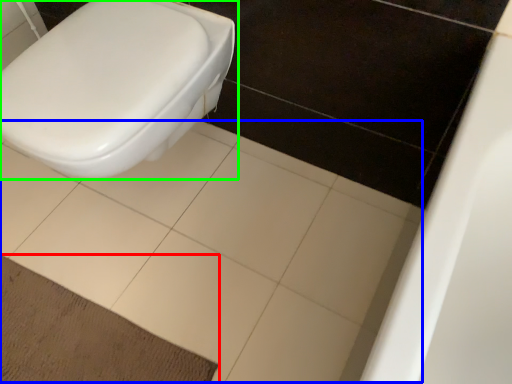
Question: Estimate the real-world distances between objects in this image. Which object is closer to doormat (highlighted by a red box), ceramic tile (highlighted by a blue box) or toilet (highlighted by a green box)?

Choices:
 (A) ceramic tile
 (B) toilet

Answer: (A)